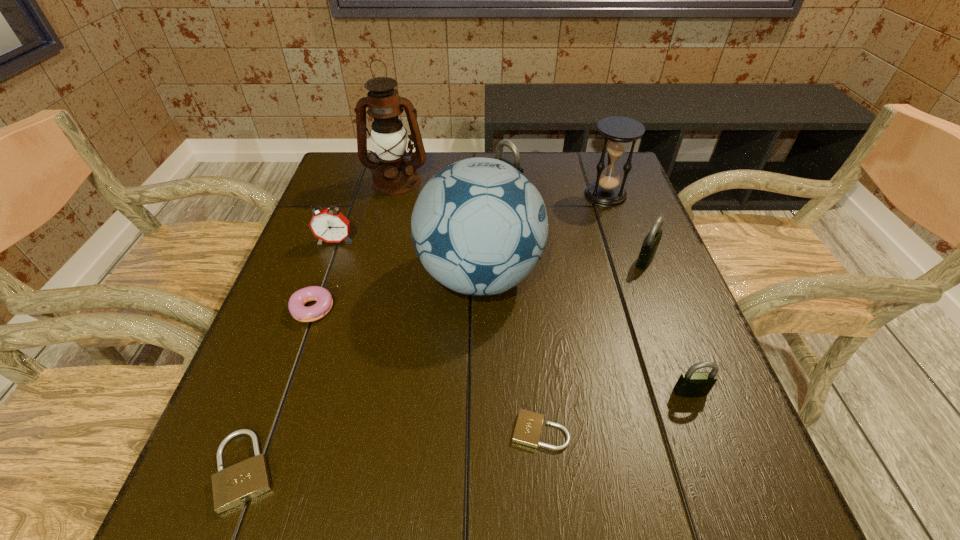
Where is `vacant point that satisfies the following two spatial constraints: 1. on the clock face of the alarm clock; 2. on the right side of the third nearest padlock`? The height and width of the screenshot is (540, 960). vacant point that satisfies the following two spatial constraints: 1. on the clock face of the alarm clock; 2. on the right side of the third nearest padlock is located at coordinates (281, 392).

Identify the location of free space that satisfies the following two spatial constraints: 1. on the side of the lantern, there is a wick adjustment knob; 2. on the left side of the fourth shortest object. This screenshot has height=540, width=960. (345, 392).

At what (x,y) coordinates should I click in order to perform the action: click on free space that satisfies the following two spatial constraints: 1. on the side of the tallest object, there is a wick adjustment knob; 2. on the left side of the seventh shortest object. Please return your answer as a coordinate pair (x, y). This screenshot has width=960, height=540. Looking at the image, I should click on (394, 190).

Locate an element on the screen. blank area in the image that satisfies the following two spatial constraints: 1. on the back side of the black hourglass; 2. on the right side of the shortest padlock is located at coordinates (516, 195).

The width and height of the screenshot is (960, 540). Identify the location of vacant space that satisfies the following two spatial constraints: 1. on the side of the shortest padlock, there is a wick adjustment knob; 2. on the left side of the brown lantern. (335, 431).